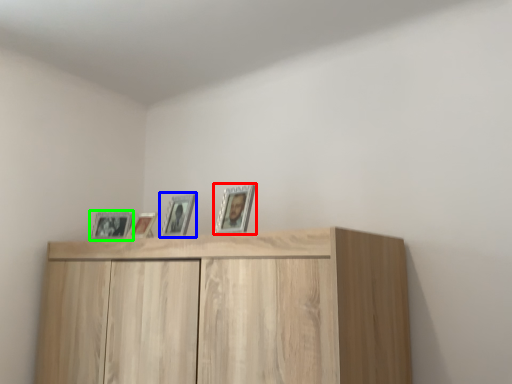
Question: Which object is the closest to the picture frame (highlighted by a red box)? Choose among these: picture frame (highlighted by a blue box) or picture frame (highlighted by a green box).

Choices:
 (A) picture frame
 (B) picture frame

Answer: (A)